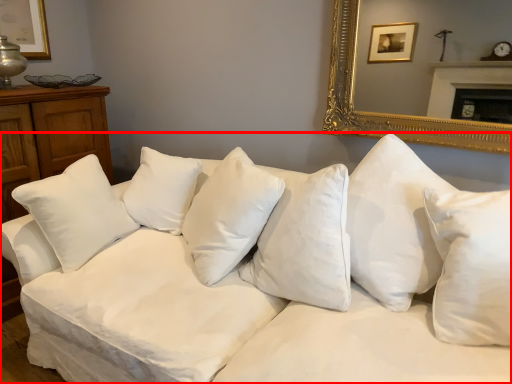
Question: From the image's perspective, where is studio couch (annotated by the red box) located in relation to pillow in the image?

Choices:
 (A) above
 (B) below

Answer: (B)